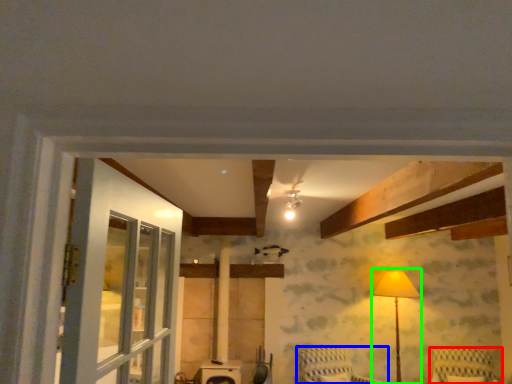
Question: Considering the real-world distances, which object is farthest from furniture (highlighted by a red box)? furniture (highlighted by a blue box) or table lamp (highlighted by a green box)?

Choices:
 (A) furniture
 (B) table lamp

Answer: (A)